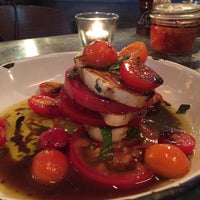
Where is `gray table`? The height and width of the screenshot is (200, 200). gray table is located at coordinates (130, 39).